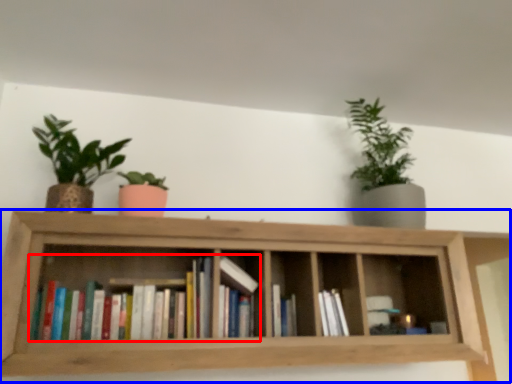
Question: Among these objects, which one is farthest to the camera, book (highlighted by a red box) or shelf (highlighted by a blue box)?

Choices:
 (A) book
 (B) shelf

Answer: (A)